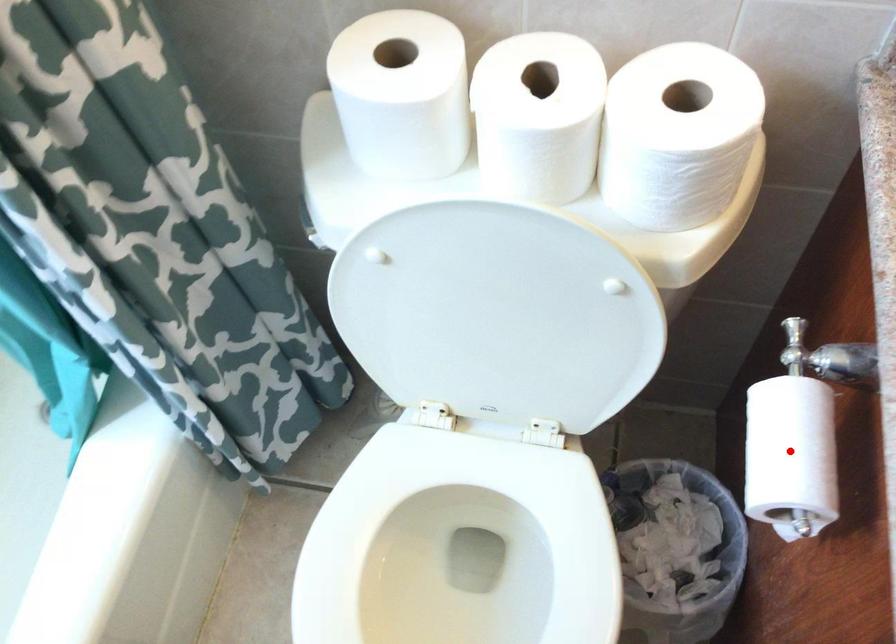
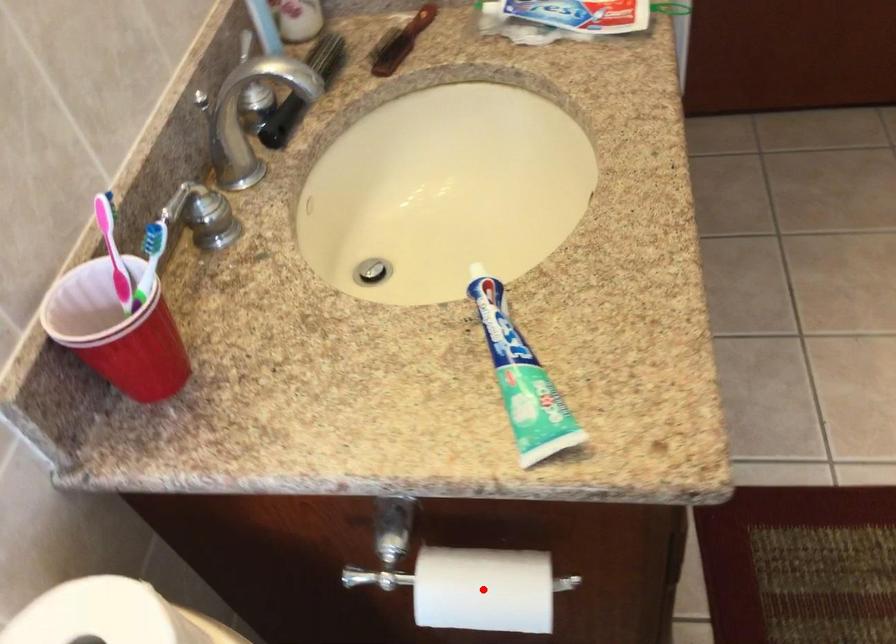
In the scene shown: I am providing you with two images of the same scene from different viewpoints. A red point is marked on the first image and another point is marked on the second image. Is the marked point in image1 the same physical position as the marked point in image2?

Yes